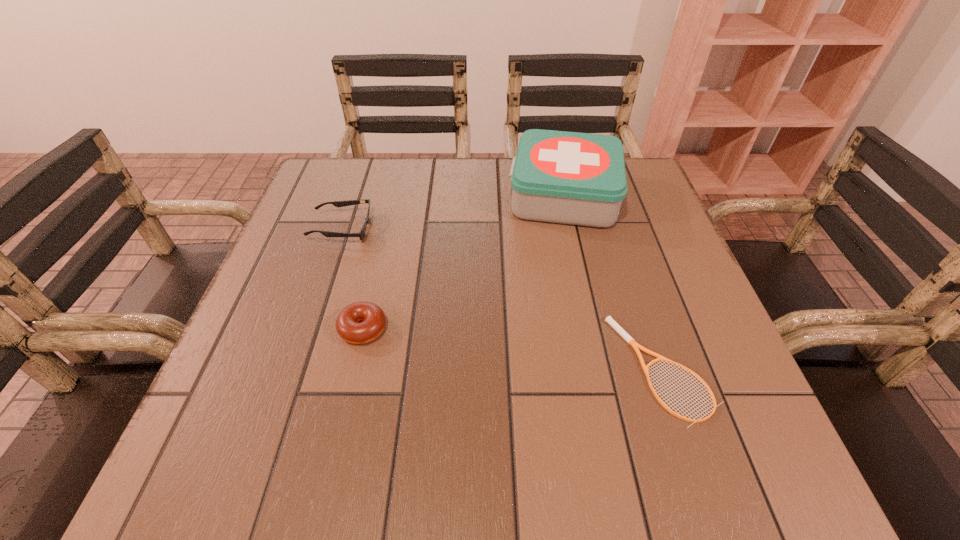
Locate an element on the screen. Image resolution: width=960 pixels, height=540 pixels. the tallest object is located at coordinates (574, 178).

This screenshot has width=960, height=540. Identify the location of sunglasses. (361, 234).

Where is `doughnut`? doughnut is located at coordinates (360, 322).

You are a GUI agent. You are given a task and a screenshot of the screen. Output one action in this format:
    pyautogui.click(x=<x>, y=<y>)
    Task: Click on the shortest object
    
    Given the screenshot: What is the action you would take?
    pyautogui.click(x=619, y=329)

At what (x,y) coordinates should I click in order to perform the action: click on free space located 0.280m on the left of the tallest object. Please return your answer as a coordinate pair (x, y). The height and width of the screenshot is (540, 960). Looking at the image, I should click on (395, 195).

Identify the location of free space located on the front-facing side of the sunglasses. The height and width of the screenshot is (540, 960). (x=459, y=228).

Find the location of `vacant position located 0.090m on the right of the doughnut`. vacant position located 0.090m on the right of the doughnut is located at coordinates (437, 328).

Identify the location of vacant space located on the left of the shortest object. The height and width of the screenshot is (540, 960). (568, 369).

This screenshot has width=960, height=540. Find the location of `the first-aid kit that is positioned at the far edge`. the first-aid kit that is positioned at the far edge is located at coordinates (574, 178).

Identify the location of sunglasses that is at the far edge. (361, 234).